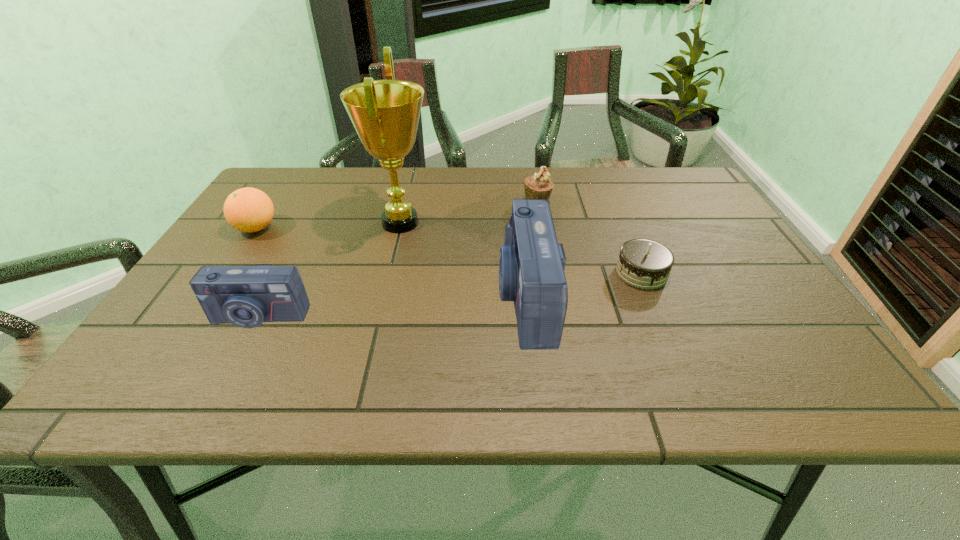
This screenshot has width=960, height=540. Identify the location of vacant area that lies between the right camera and the tallest object. (463, 260).

Identify the location of free space between the right camera and the rightmost object. (584, 285).

I want to click on unoccupied position between the shortest object and the orange, so click(x=449, y=251).

Identify the location of vacant space that's between the chocolate cake and the orange. The height and width of the screenshot is (540, 960). (449, 251).

Where is `free space between the third object from left to right and the orange`? free space between the third object from left to right and the orange is located at coordinates (328, 225).

At what (x,y) coordinates should I click in order to perform the action: click on object that ranks as the closest to the shortest object. Please return your answer as a coordinate pair (x, y). The width and height of the screenshot is (960, 540). Looking at the image, I should click on (531, 263).

This screenshot has width=960, height=540. Find the location of `object that can be found as the fourth closest to the orange`. object that can be found as the fourth closest to the orange is located at coordinates (539, 186).

This screenshot has height=540, width=960. Find the location of `vacant position in the image that satisfies the following two spatial constraints: 1. on the front view with handles of the tallest object; 2. on the lens of the shorter camera`. vacant position in the image that satisfies the following two spatial constraints: 1. on the front view with handles of the tallest object; 2. on the lens of the shorter camera is located at coordinates (377, 316).

Locate an element on the screen. vacant region that satisfies the following two spatial constraints: 1. on the lens of the right camera; 2. on the lens of the shorter camera is located at coordinates (528, 316).

You are a GUI agent. You are given a task and a screenshot of the screen. Output one action in this format:
    pyautogui.click(x=<x>, y=<y>)
    Task: Click on the vacant space that satisfies the following two spatial constraints: 1. on the back side of the shortest object; 2. on the front view with handles of the third object from left to right
    This screenshot has height=540, width=960.
    Given the screenshot: What is the action you would take?
    pyautogui.click(x=620, y=223)